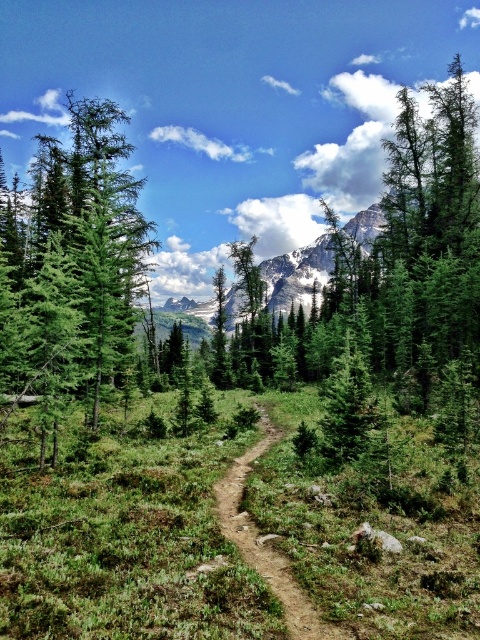
Question: Which of the following is the closest to the observer?

Choices:
 (A) green matte tree at left
 (B) brown dirt track at center

Answer: (B)

Question: Does green matte tree at left appear on the right side of brown dirt track at center?

Choices:
 (A) no
 (B) yes

Answer: (A)

Question: Which point appears farthest from the camera in this image?

Choices:
 (A) [91, 317]
 (B) [216, 484]

Answer: (A)

Question: Is green matte tree at left positioned at the back of brown dirt track at center?

Choices:
 (A) yes
 (B) no

Answer: (A)

Question: Does green matte tree at left have a greater width compared to brown dirt track at center?

Choices:
 (A) yes
 (B) no

Answer: (A)